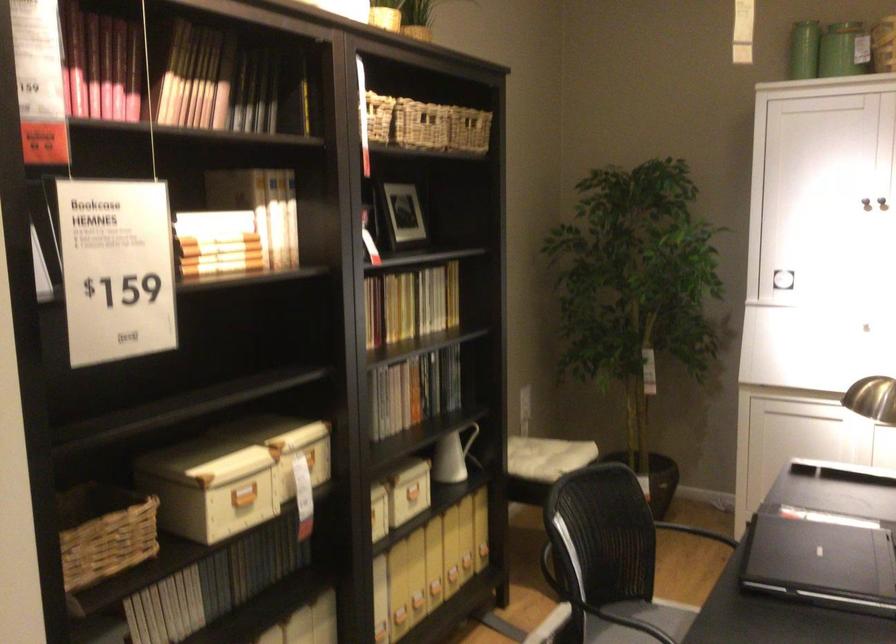
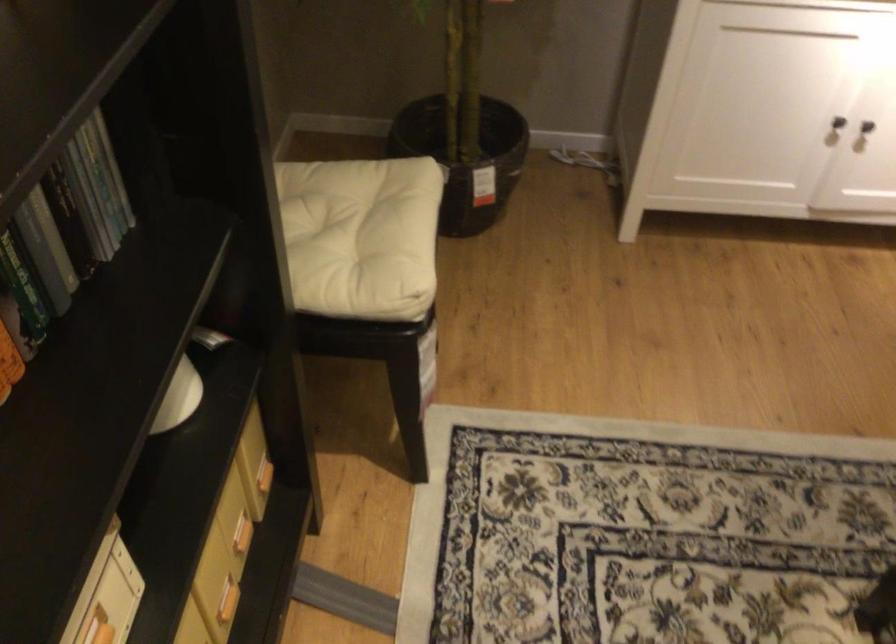
Find the pixel in the second image that matches point (419, 402) in the first image.

(22, 288)